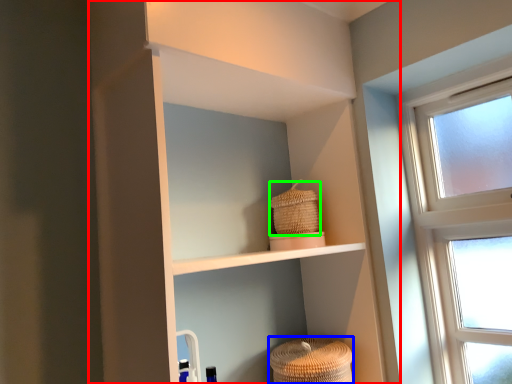
Question: Which is nearer to the shelf (highlighted by a red box)? basket (highlighted by a blue box) or basket (highlighted by a green box).

Choices:
 (A) basket
 (B) basket

Answer: (B)